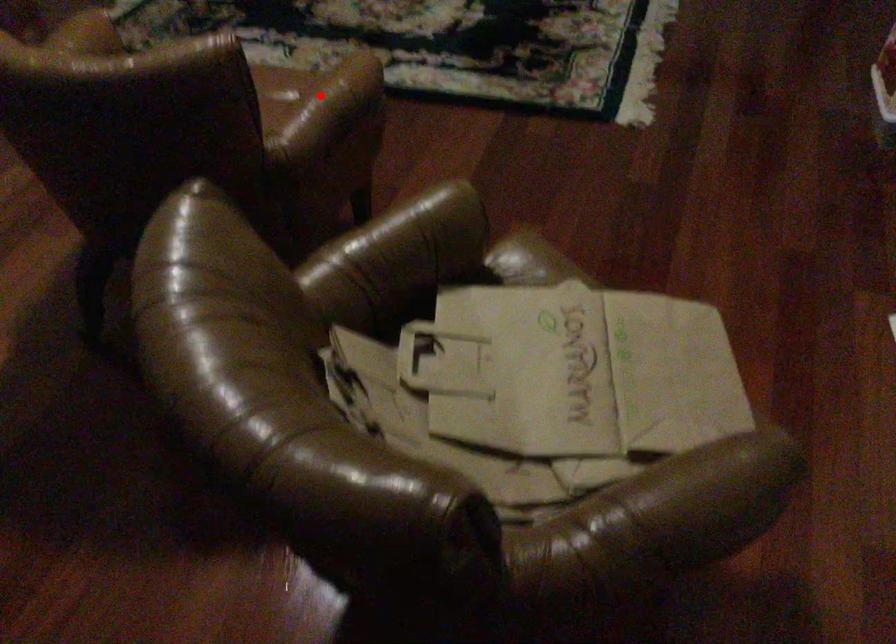
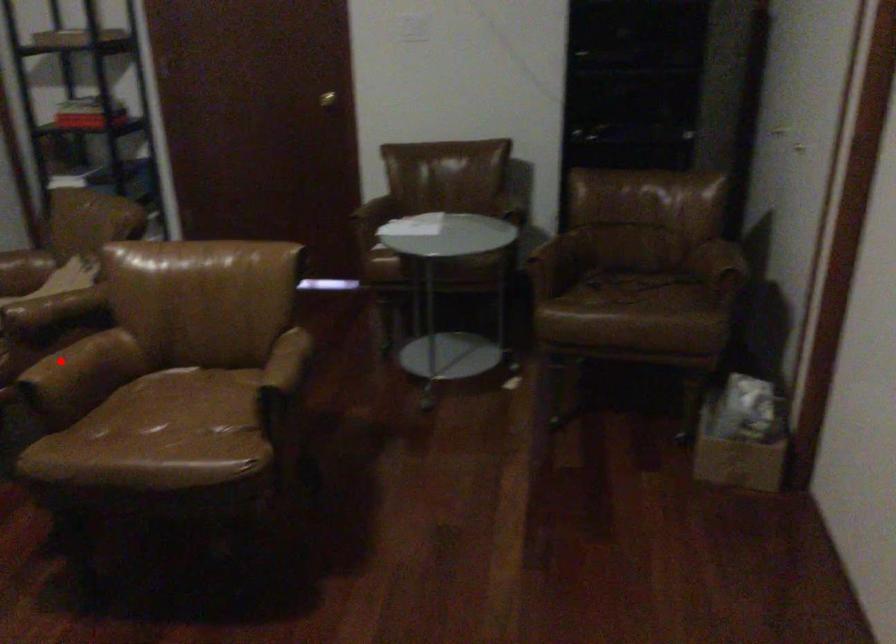
I am providing you with two images of the same scene from different viewpoints. A red point is marked on the first image and another point is marked on the second image. Does the point marked in image1 correspond to the same location as the one in image2?

Yes